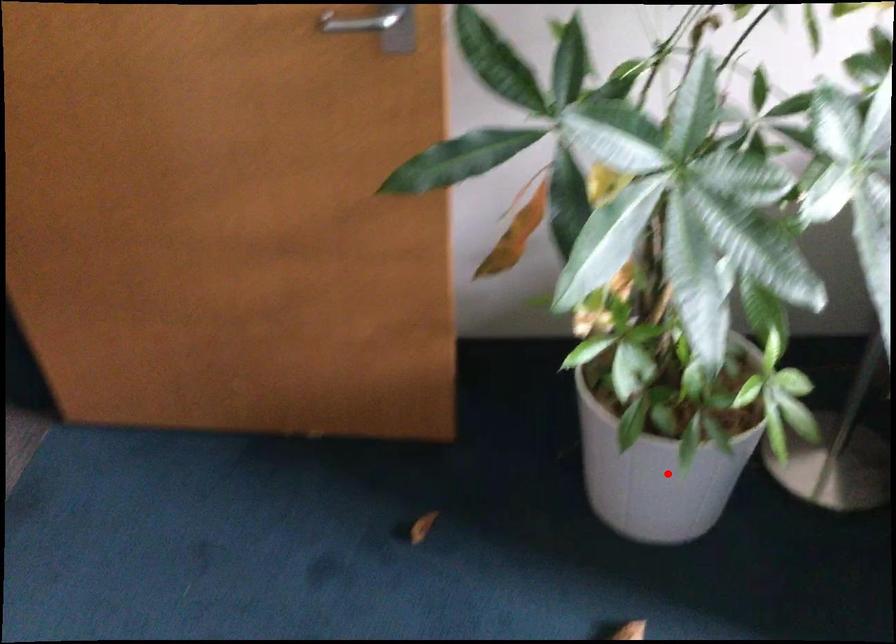
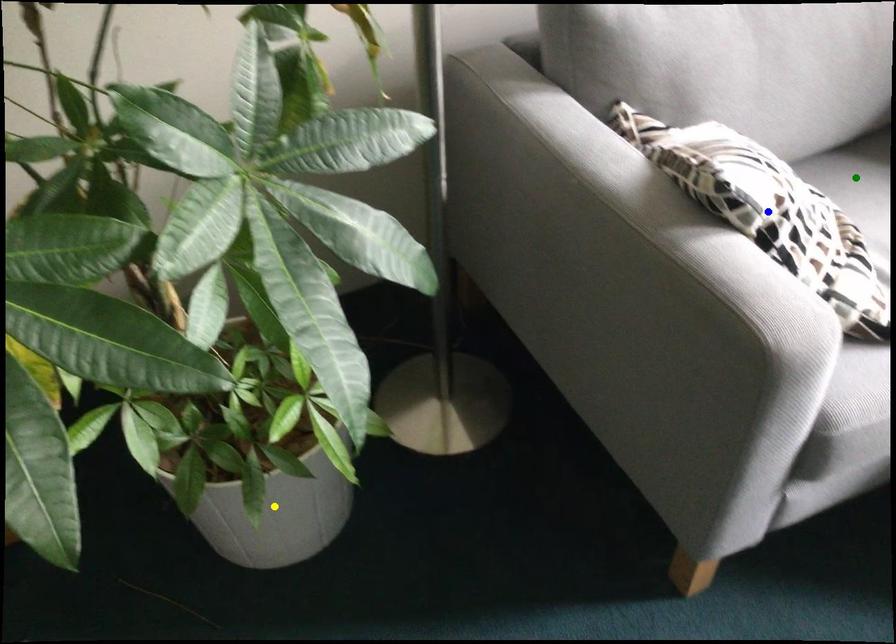
Question: I am providing you with two images of the same scene from different viewpoints. A red point is marked on the first image. You are given multiple points on the second image. Which spot in image 2 lines up with the point in image 1?

Choices:
 (A) blue point
 (B) yellow point
 (C) green point

Answer: (B)